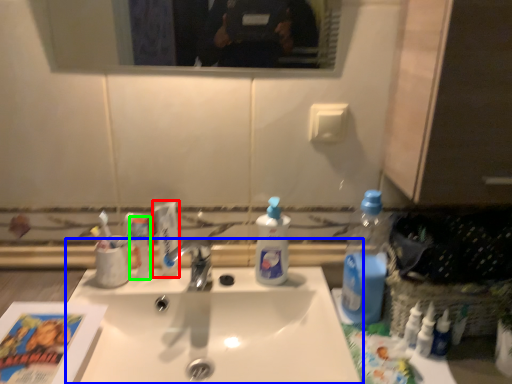
Question: Based on their relative distances, which object is nearer to toothpaste (highlighted by a red box)? Choose from sink (highlighted by a blue box) and toiletry (highlighted by a green box).

Choices:
 (A) sink
 (B) toiletry

Answer: (B)